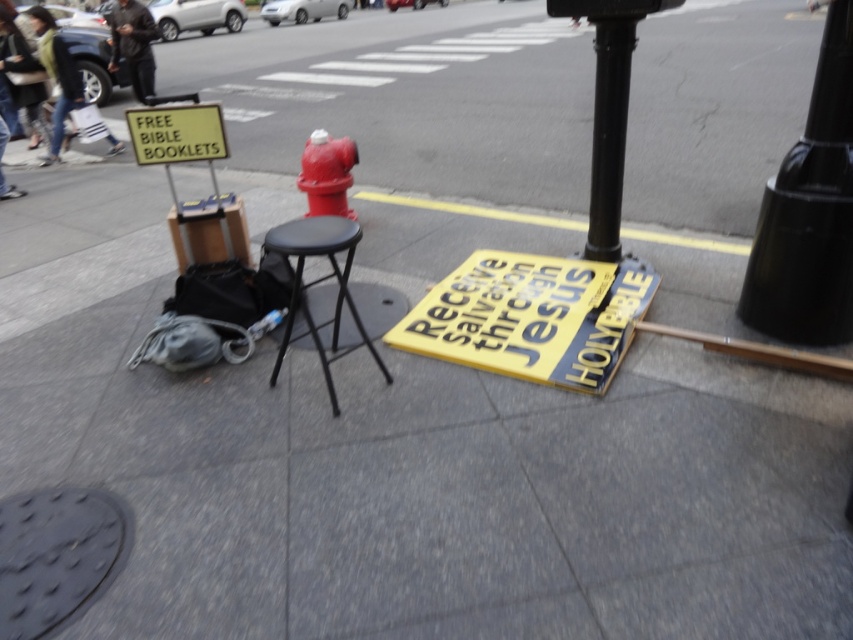
Question: Among these objects, which one is farthest from the camera?

Choices:
 (A) black metal stool at center
 (B) yellow paper sign at lower center
 (C) black metal pole at upper center
 (D) black rubber manhole cover at lower left

Answer: (C)

Question: Which of the following is the closest to the observer?

Choices:
 (A) (825, 284)
 (B) (209, 141)
 (C) (450, 333)
 (D) (144, 38)

Answer: (A)

Question: Which object appears closest to the camera in this image?

Choices:
 (A) black metal pole at upper center
 (B) glossy metal fire hydrant at center
 (C) dark gray jacket at upper left
 (D) yellow paper sign at upper left

Answer: (A)

Question: Is yellow paper sign at upper left closer to the viewer compared to dark gray jacket at upper left?

Choices:
 (A) yes
 (B) no

Answer: (A)

Question: Where is black glossy pole at upper right located in relation to black metal stool at center in the image?

Choices:
 (A) below
 (B) above

Answer: (B)

Question: Does yellow paper sign at upper left lie behind glossy metal fire hydrant at center?

Choices:
 (A) no
 (B) yes

Answer: (A)